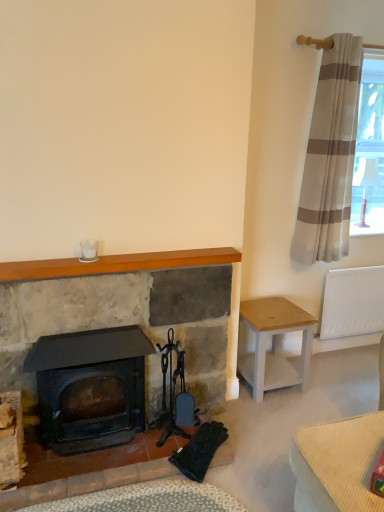
This screenshot has width=384, height=512. What do you see at coordinates (366, 184) in the screenshot?
I see `white fabric lampshade at upper right` at bounding box center [366, 184].

What do you see at coordinates (89, 250) in the screenshot?
I see `white glass at upper center` at bounding box center [89, 250].

Measure the distance between point (84, 250) and camera.

The distance of point (84, 250) from camera is 6.79 feet.

The width and height of the screenshot is (384, 512). What do you see at coordinates (117, 264) in the screenshot?
I see `wooden mantle at upper center` at bounding box center [117, 264].

Locate an element on the screen. Image resolution: width=384 pixels, height=512 pixels. matte black wood burning stove at center-left is located at coordinates (90, 387).

Identify the location of white fabric lampshade at upper right. (366, 184).

Between beige striped curtain at upper right and matte black wood burning stove at center-left, which one appears on the left side from the viewer's perspective?

matte black wood burning stove at center-left is more to the left.

From the image's perspective, does beige striped curtain at upper right appear lower than matte black wood burning stove at center-left?

No.

From a real-world perspective, who is located higher, beige striped curtain at upper right or matte black wood burning stove at center-left?

beige striped curtain at upper right, from a real-world perspective.

Is matte black wood burning stove at center-left surrounded by beige striped curtain at upper right?

No.

Which is in front, point (279, 383) or point (130, 368)?

The point (130, 368) is more forward.

From the picture: From the image's perspective, is white wood stool at right on top of matte black wood burning stove at center-left?

Yes.

In the scene shown: Can you tell me how much white wood stool at right and matte black wood burning stove at center-left differ in facing direction?

There is a 4.15-degree angle between the facing directions of white wood stool at right and matte black wood burning stove at center-left.

Which object is closer to the camera taking this photo, white wood stool at right or matte black wood burning stove at center-left?

matte black wood burning stove at center-left is closer to the camera.

From the image's perspective, is white plastic radiator at right above or below matte black wood burning stove at center-left?

Based on their image positions, white plastic radiator at right is located above matte black wood burning stove at center-left.

Which is behind, point (349, 326) or point (65, 408)?

Point (349, 326)

Is the position of white plastic radiator at right less distant than that of matte black wood burning stove at center-left?

No, white plastic radiator at right is further to the viewer.

Looking at this image, can you tell me how much white plastic radiator at right and matte black wood burning stove at center-left differ in facing direction?

0.776 degrees separate the facing orientations of white plastic radiator at right and matte black wood burning stove at center-left.

Is white plastic radiator at right oriented towards matte stone fireplace at center?

No, white plastic radiator at right is not aimed at matte stone fireplace at center.

Is white plastic radiator at right located outside matte stone fireplace at center?

Yes.

From a real-world perspective, between white plastic radiator at right and matte stone fireplace at center, who is vertically lower?

white plastic radiator at right is physically lower.

Considering the positions of point (339, 313) and point (95, 294), is point (339, 313) closer or farther from the camera than point (95, 294)?

Point (339, 313).

Considering the sizes of objects matte black wood burning stove at center-left and white plastic radiator at right in the image provided, who is shorter, matte black wood burning stove at center-left or white plastic radiator at right?

With less height is white plastic radiator at right.

From a real-world perspective, is matte black wood burning stove at center-left on white plastic radiator at right?

No, from a real-world perspective, matte black wood burning stove at center-left is not on top of white plastic radiator at right.

Is matte black wood burning stove at center-left not within white plastic radiator at right?

Yes.

Is matte black wood burning stove at center-left looking in the opposite direction of white plastic radiator at right?

No, matte black wood burning stove at center-left's orientation is not away from white plastic radiator at right.

Considering the sizes of white glass at upper center and wooden mantle at upper center in the image, is white glass at upper center taller or shorter than wooden mantle at upper center?

In the image, white glass at upper center appears to be taller than wooden mantle at upper center.

From the image's perspective, relative to wooden mantle at upper center, is white glass at upper center above or below?

Clearly, from the image's perspective, white glass at upper center is above wooden mantle at upper center.

Relative to wooden mantle at upper center, is white glass at upper center in front or behind?

Visually, white glass at upper center is located behind wooden mantle at upper center.

Is white glass at upper center positioned with its back to wooden mantle at upper center?

No, white glass at upper center is not facing away from wooden mantle at upper center.

From a real-world perspective, which object stands above the other?

From a 3D spatial view, white fabric lampshade at upper right is above.

Is wooden mantle at upper center aimed at white fabric lampshade at upper right?

No, wooden mantle at upper center is not oriented towards white fabric lampshade at upper right.

Can you confirm if wooden mantle at upper center is taller than white fabric lampshade at upper right?

No.

How much distance is there between wooden mantle at upper center and white fabric lampshade at upper right?

They are 4.72 feet apart.

Where is `curtain above the matte black wood burning stove at center-left (from a real-world perspective)`? This screenshot has height=512, width=384. curtain above the matte black wood burning stove at center-left (from a real-world perspective) is located at coordinates (330, 153).

Image resolution: width=384 pixels, height=512 pixels. What are the coordinates of `wood burning stove in front of the white wood stool at right` in the screenshot? It's located at (90, 387).

Estimate the real-world distances between objects in this image. Which object is closer to matte stone fireplace at center, white wood stool at right or beige striped curtain at upper right?

The object closer to matte stone fireplace at center is white wood stool at right.

Based on their spatial positions, is matte black wood burning stove at center-left or white wood stool at right further from wooden mantle at upper center?

white wood stool at right.

Considering their positions, is white fabric lampshade at upper right positioned further to white wood stool at right than matte black wood burning stove at center-left?

Based on the image, white fabric lampshade at upper right appears to be further to white wood stool at right.

When comparing their distances from white glass at upper center, does white fabric lampshade at upper right or wooden mantle at upper center seem closer?

wooden mantle at upper center is positioned closer to the anchor white glass at upper center.

Estimate the real-world distances between objects in this image. Which object is closer to white plastic radiator at right, beige striped curtain at upper right or white glass at upper center?

Based on the image, beige striped curtain at upper right appears to be nearer to white plastic radiator at right.

Which object lies nearer to the anchor point white fabric lampshade at upper right, wooden mantle at upper center or matte black wood burning stove at center-left?

Among the two, wooden mantle at upper center is located nearer to white fabric lampshade at upper right.

When comparing their distances from matte black wood burning stove at center-left, does white plastic radiator at right or white glass at upper center seem further?

white plastic radiator at right lies further to matte black wood burning stove at center-left than the other object.

Which object lies nearer to the anchor point beige striped curtain at upper right, wooden mantle at upper center or matte black wood burning stove at center-left?

The object closer to beige striped curtain at upper right is wooden mantle at upper center.

In order to click on fireplace between white glass at upper center and white plastic radiator at right in the horizontal direction in this screenshot , I will do `click(121, 311)`.

Find the location of a particular element. The image size is (384, 512). fireplace between matte black wood burning stove at center-left and beige striped curtain at upper right in the horizontal direction is located at coordinates (121, 311).

Locate an element on the screen. The width and height of the screenshot is (384, 512). radiator situated between white glass at upper center and white fabric lampshade at upper right from left to right is located at coordinates (353, 302).

At what (x,y) coordinates should I click in order to perform the action: click on radiator situated between matte black wood burning stove at center-left and white fabric lampshade at upper right from left to right. Please return your answer as a coordinate pair (x, y). Image resolution: width=384 pixels, height=512 pixels. Looking at the image, I should click on (353, 302).